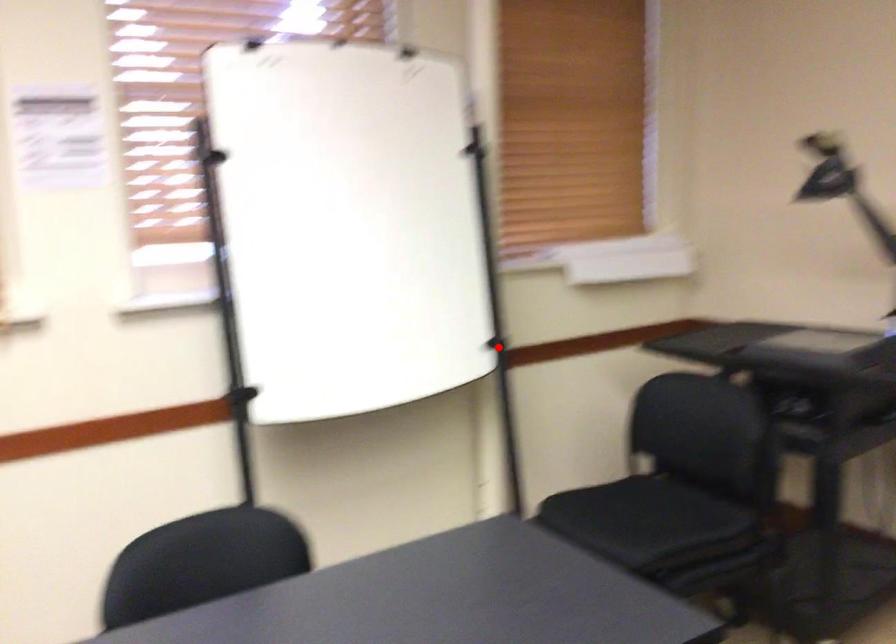
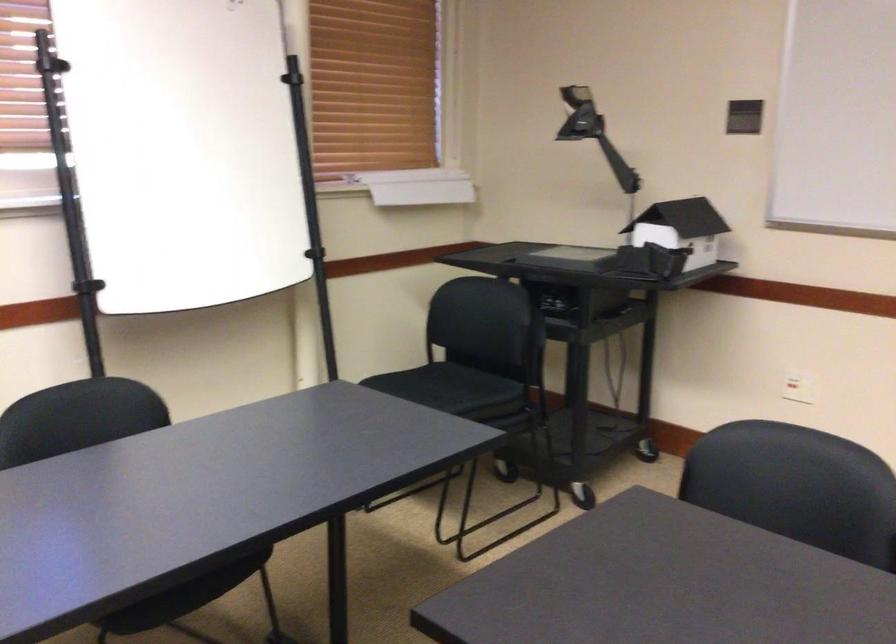
Find the pixel in the second image that matches the highlighted location in the first image.

(321, 254)